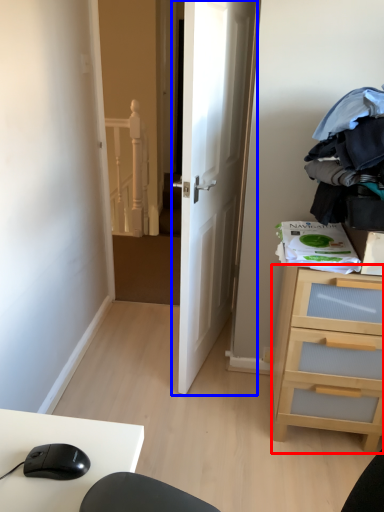
Question: Which point is closer to the camera, chest of drawers (highlighted by a red box) or door (highlighted by a blue box)?

Choices:
 (A) chest of drawers
 (B) door

Answer: (B)